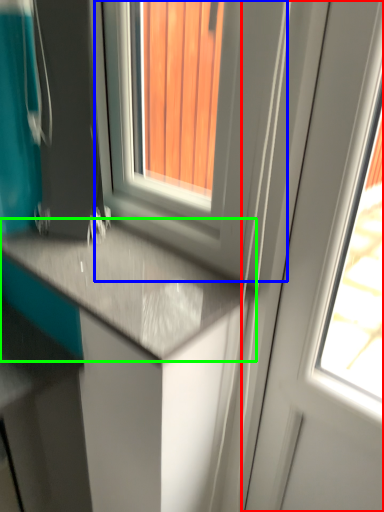
Question: Which is nearer to the screen door (highlighted by a red box)? window (highlighted by a blue box) or countertop (highlighted by a green box).

Choices:
 (A) window
 (B) countertop

Answer: (A)